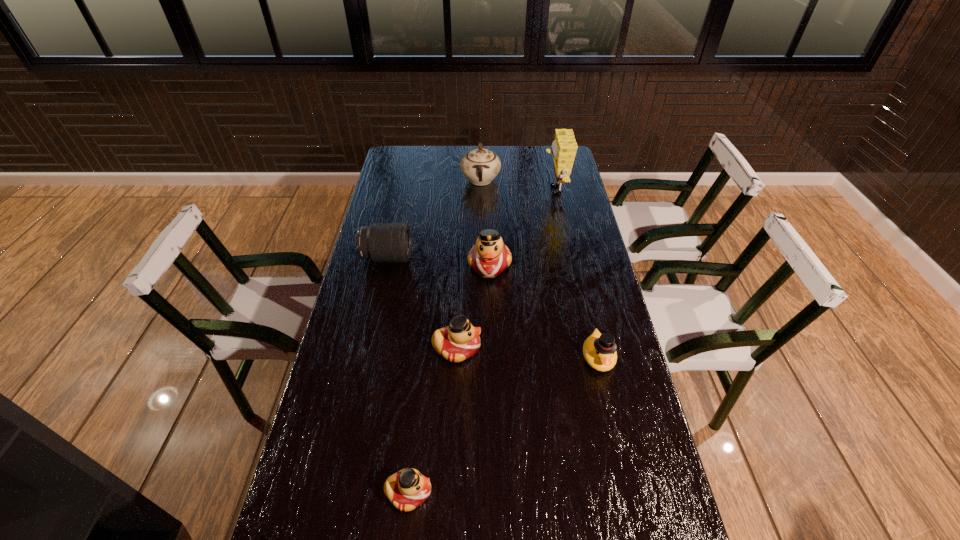
Locate an element on the screen. This screenshot has width=960, height=540. empty space between the yellow duck and the second farthest red duck is located at coordinates pyautogui.click(x=527, y=353).

This screenshot has height=540, width=960. What are the coordinates of `free space between the sponge and the white chinaware` in the screenshot? It's located at (517, 185).

You are a GUI agent. You are given a task and a screenshot of the screen. Output one action in this format:
    pyautogui.click(x=<x>, y=<y>)
    Task: Click on the unoccupied position between the chinaware and the yellow duck
    This screenshot has height=540, width=960.
    Given the screenshot: What is the action you would take?
    pyautogui.click(x=540, y=268)

Find the location of a particular element. vacant area between the shortest duck and the yellow duck is located at coordinates (503, 424).

Locate an element on the screen. Image resolution: width=960 pixels, height=540 pixels. free space between the gray telephoto lens and the yellow sponge is located at coordinates (470, 224).

Identify the location of vacant area between the rightmost duck and the white chinaware. (540, 268).

Where is `free space between the chinaware and the farthest red duck`? free space between the chinaware and the farthest red duck is located at coordinates (485, 222).

Select which object is the third closest to the second farthest red duck. Please provide its 2D coordinates. Your answer should be formatted as a tuple, i.e. [(x, y)], where the tuple contains the x and y coordinates of a point satisfying the conditions above.

[(599, 350)]

This screenshot has width=960, height=540. Find the location of `object that is the sixth closest one to the gray telephoto lens`. object that is the sixth closest one to the gray telephoto lens is located at coordinates (407, 489).

Image resolution: width=960 pixels, height=540 pixels. What are the coordinates of `duck that is the closest to the second farthest red duck` in the screenshot? It's located at coord(489,257).